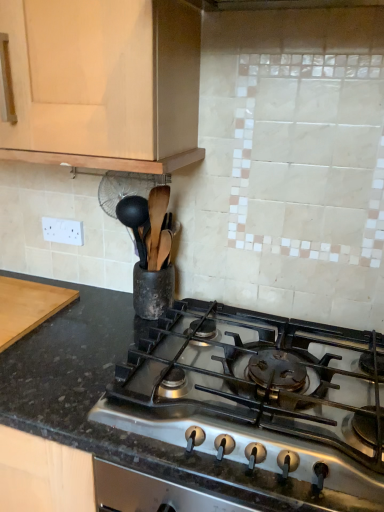
Question: From the image's perspective, would you say matte wood cabinet at upper left is shown under wooden cutting board at left?

Choices:
 (A) no
 (B) yes

Answer: (A)

Question: Can you confirm if matte wood cabinet at upper left is wider than wooden cutting board at left?

Choices:
 (A) yes
 (B) no

Answer: (B)

Question: Would you say matte wood cabinet at upper left is outside wooden cutting board at left?

Choices:
 (A) yes
 (B) no

Answer: (A)

Question: Does matte wood cabinet at upper left appear on the right side of wooden cutting board at left?

Choices:
 (A) yes
 (B) no

Answer: (A)

Question: From a real-world perspective, is matte wood cabinet at upper left beneath wooden cutting board at left?

Choices:
 (A) no
 (B) yes

Answer: (A)

Question: Does point (304, 444) appear closer or farther from the camera than point (51, 291)?

Choices:
 (A) closer
 (B) farther

Answer: (A)

Question: From a real-world perspective, is black granite countertop at center physically located above or below wooden cutting board at left?

Choices:
 (A) above
 (B) below

Answer: (A)

Question: Which is correct: black granite countertop at center is inside wooden cutting board at left, or outside of it?

Choices:
 (A) outside
 (B) inside

Answer: (A)

Question: Looking at their shapes, would you say black granite countertop at center is wider or thinner than wooden cutting board at left?

Choices:
 (A) wide
 (B) thin

Answer: (A)

Question: Relative to black granite countertop at center, is wooden cutting board at left in front or behind?

Choices:
 (A) behind
 (B) front

Answer: (A)

Question: From the image's perspective, is wooden cutting board at left positioned above or below black granite countertop at center?

Choices:
 (A) below
 (B) above

Answer: (B)

Question: Considering the relative positions of wooden cutting board at left and black granite countertop at center in the image provided, is wooden cutting board at left to the left or to the right of black granite countertop at center?

Choices:
 (A) right
 (B) left

Answer: (B)

Question: Is wooden cutting board at left wider or thinner than black granite countertop at center?

Choices:
 (A) wide
 (B) thin

Answer: (B)

Question: Does point (21, 324) appear closer or farther from the camera than point (122, 119)?

Choices:
 (A) farther
 (B) closer

Answer: (A)

Question: Is wooden cutting board at left wider or thinner than matte wood cabinet at upper left?

Choices:
 (A) wide
 (B) thin

Answer: (A)